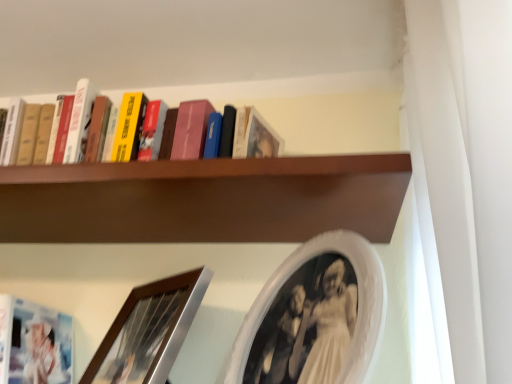
Question: Is point (320, 120) closer or farther from the camera than point (131, 354)?

Choices:
 (A) farther
 (B) closer

Answer: (A)

Question: From a real-world perspective, is brown wooden shelf at upper center above or below brushed silver picture frame at lower left, positioned as the first picture frame in left-to-right order?

Choices:
 (A) below
 (B) above

Answer: (B)

Question: Estimate the real-world distances between objects in this image. Which object is closer to the brown wooden shelf at upper center?

Choices:
 (A) brushed silver picture frame at lower left, which is the 2th picture frame in right-to-left order
 (B) white oval picture frame at upper center, which is the 2th picture frame in left-to-right order

Answer: (B)

Question: Estimate the real-world distances between objects in this image. Which object is farther from the brushed silver picture frame at lower left, which is the 2th picture frame in right-to-left order?

Choices:
 (A) white oval picture frame at upper center, which is the 2th picture frame in left-to-right order
 (B) brown wooden shelf at upper center

Answer: (B)